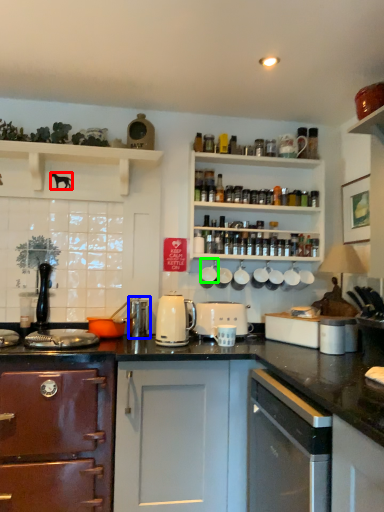
Question: Considering the real-world distances, which object is farthest from animal (highlighted by a red box)? appliance (highlighted by a blue box) or appliance (highlighted by a green box)?

Choices:
 (A) appliance
 (B) appliance

Answer: (B)